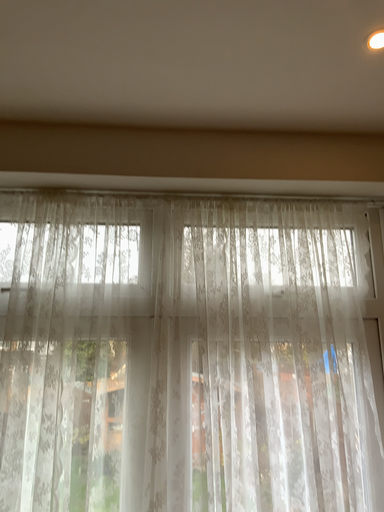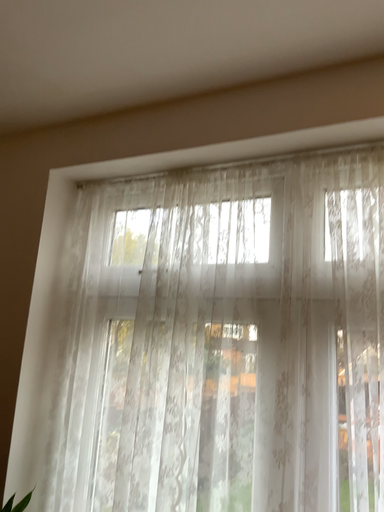
Question: How did the camera likely rotate when shooting the video?

Choices:
 (A) rotated right
 (B) rotated left

Answer: (B)